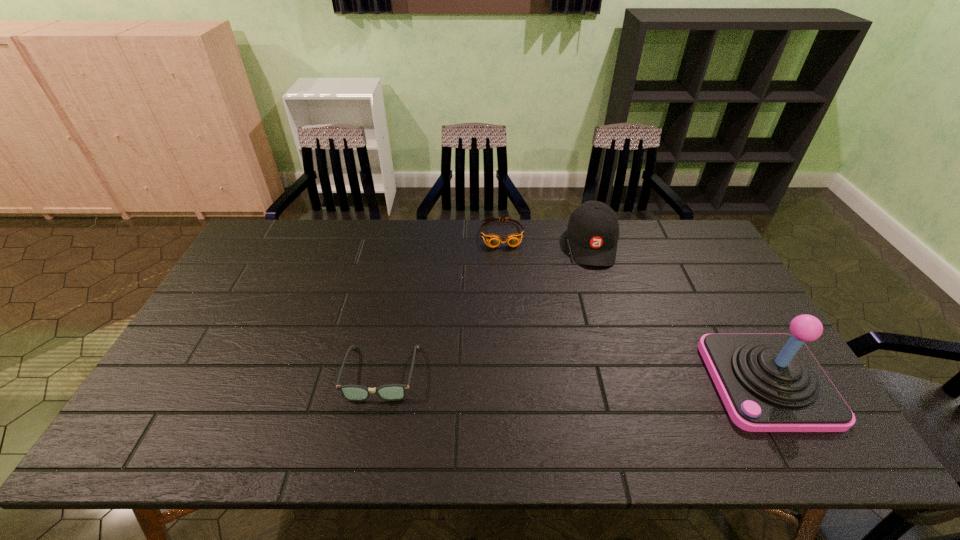
Point out which object is positioned as the third nearest to the goggles. Please provide its 2D coordinates. Your answer should be formatted as a tuple, i.e. [(x, y)], where the tuple contains the x and y coordinates of a point satisfying the conditions above.

[(768, 382)]

Where is `vacant point that satisfies the following two spatial constraints: 1. on the front side of the second tallest object; 2. forward from the base of the joystick`? The width and height of the screenshot is (960, 540). vacant point that satisfies the following two spatial constraints: 1. on the front side of the second tallest object; 2. forward from the base of the joystick is located at coordinates [635, 382].

The height and width of the screenshot is (540, 960). I want to click on free region that satisfies the following two spatial constraints: 1. on the front side of the baseball cap; 2. forward from the base of the tallest object, so click(635, 382).

The height and width of the screenshot is (540, 960). I want to click on vacant space that satisfies the following two spatial constraints: 1. on the face of the spectacles; 2. forward from the base of the tallest object, so tap(379, 382).

The height and width of the screenshot is (540, 960). In order to click on vacant space that satisfies the following two spatial constraints: 1. on the face of the tallest object; 2. forward from the base of the leftmost object in this screenshot , I will do `click(379, 382)`.

Where is `vacant area in the image that satisfies the following two spatial constraints: 1. on the face of the leftmost object; 2. forward from the base of the tallest object`? vacant area in the image that satisfies the following two spatial constraints: 1. on the face of the leftmost object; 2. forward from the base of the tallest object is located at coordinates (379, 382).